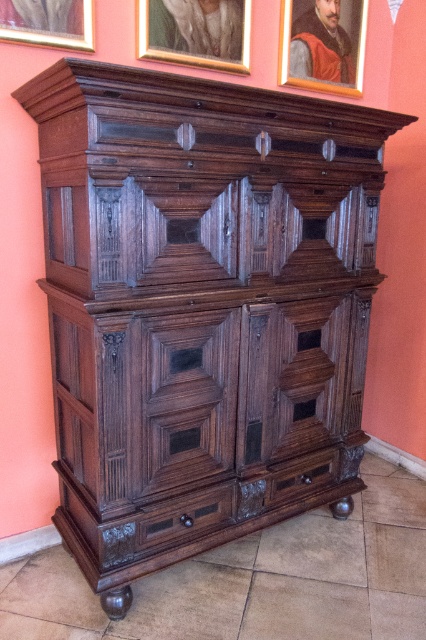
Question: Which point is closer to the camera taking this photo?

Choices:
 (A) (213, 67)
 (B) (52, 17)

Answer: (B)

Question: Is goldmetallicpicture frame at upper center wider than wooden frame at upper center?

Choices:
 (A) yes
 (B) no

Answer: (A)

Question: Which of these objects is positioned closest to the wooden frame at upper center?

Choices:
 (A) goldmetallicpicture frame at upper center
 (B) brushed metal picture frame at upper left

Answer: (A)

Question: Which object is closer to the camera taking this photo?

Choices:
 (A) brushed metal picture frame at upper left
 (B) wooden frame at upper center
 (C) goldmetallicpicture frame at upper center

Answer: (A)

Question: Is wooden frame at upper center wider than brushed metal picture frame at upper left?

Choices:
 (A) no
 (B) yes

Answer: (B)

Question: Is wooden frame at upper center closer to the viewer compared to brushed metal picture frame at upper left?

Choices:
 (A) no
 (B) yes

Answer: (A)